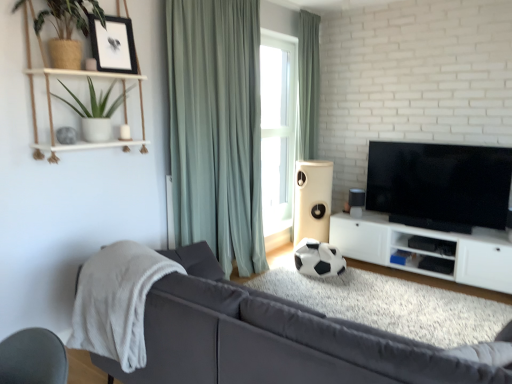
At what (x,y) coordinates should I click in order to perform the action: click on vacant region above light green fabric curtain at upper center, the second curtain from the front (from a real-world perspective). Please return your answer as a coordinate pair (x, y). The width and height of the screenshot is (512, 384). Looking at the image, I should click on (311, 11).